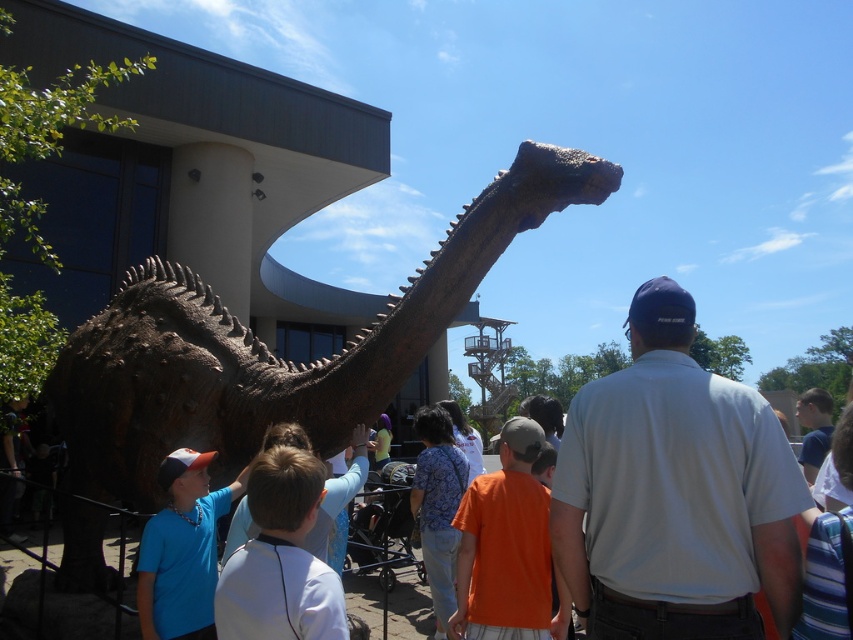
Question: Does gray cotton shirt at center lie in front of blue shirt at upper right?

Choices:
 (A) yes
 (B) no

Answer: (A)

Question: Can you confirm if gray cotton shirt at center is smaller than blue shirt at upper right?

Choices:
 (A) no
 (B) yes

Answer: (B)

Question: Is the position of gray cotton shirt at center more distant than that of light blue shirt at center?

Choices:
 (A) no
 (B) yes

Answer: (B)

Question: Among these points, which one is nearest to the camera?

Choices:
 (A) (689, 560)
 (B) (380, 456)
 (C) (567, 150)

Answer: (A)

Question: Which object appears closest to the camera in this image?

Choices:
 (A) light blue shirt at center
 (B) rustic wood statue at center

Answer: (A)

Question: Which of these objects is positioned closest to the orange shirt at center?

Choices:
 (A) blue shirt at left
 (B) rustic wood statue at center
 (C) orange cotton shirt at center

Answer: (A)